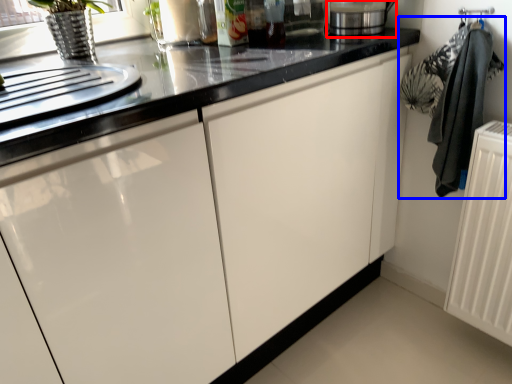
Question: Among these objects, which one is nearest to the camera, appliance (highlighted by a red box) or laundry (highlighted by a blue box)?

Choices:
 (A) appliance
 (B) laundry

Answer: (B)